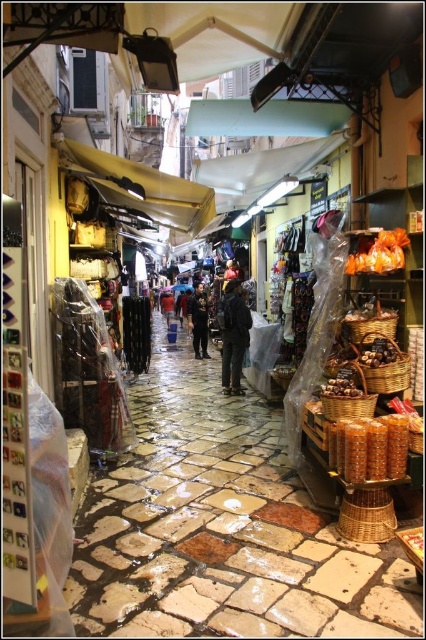
Which of these two, translucent plastic bag at center or dark blue jeans at center, stands shorter?

Standing shorter between the two is translucent plastic bag at center.

Is point (379, 428) more distant than point (170, 296)?

No, it is not.

Describe the element at coordinates (368, 449) in the screenshot. This screenshot has width=426, height=640. I see `translucent plastic bag at center` at that location.

Image resolution: width=426 pixels, height=640 pixels. I want to click on translucent plastic bag at center, so click(x=368, y=449).

Does matte wicker basket at center appear on the right side of black leather pants at center?

Indeed, matte wicker basket at center is positioned on the right side of black leather pants at center.

Is matte wicker basket at center taller than black leather pants at center?

No, matte wicker basket at center is not taller than black leather pants at center.

Where is `matte wicker basket at center`? The height and width of the screenshot is (640, 426). matte wicker basket at center is located at coordinates (221, 529).

At what (x,y) coordinates should I click in order to perform the action: click on matte wicker basket at center. Please return your answer as a coordinate pair (x, y). This screenshot has width=426, height=640. Looking at the image, I should click on (221, 529).

Is brown matte nuts at center-right bigger than brown matte mushrooms at center?

Yes.

Can you confirm if brown matte nuts at center-right is wider than brown matte mushrooms at center?

In fact, brown matte nuts at center-right might be narrower than brown matte mushrooms at center.

Image resolution: width=426 pixels, height=640 pixels. I want to click on brown matte nuts at center-right, so click(x=377, y=352).